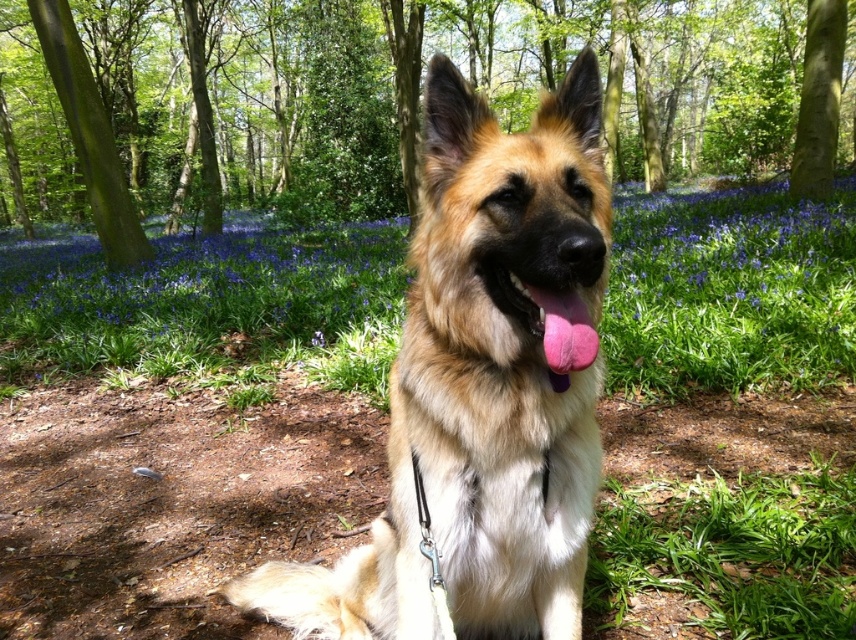
Does point (467, 529) come behind point (123, 211)?

No, it is not.

Between golden fur dog at center and green rough bark tree at upper left, which one appears on the right side from the viewer's perspective?

Positioned to the right is golden fur dog at center.

Where is `golden fur dog at center`? The height and width of the screenshot is (640, 856). golden fur dog at center is located at coordinates (483, 385).

Find the location of `golden fur dog at center`. golden fur dog at center is located at coordinates (483, 385).

Is green leafy tree at center bigger than green rough bark tree at upper left?

Correct, green leafy tree at center is larger in size than green rough bark tree at upper left.

Does point (236, 42) lie in front of point (60, 65)?

No, (236, 42) is further to viewer.

Is point (412, 150) more distant than point (143, 244)?

Yes, point (412, 150) is behind point (143, 244).

You are a GUI agent. You are given a task and a screenshot of the screen. Output one action in this format:
    pyautogui.click(x=<x>, y=<y>)
    Task: Click on the green leafy tree at center
    The height and width of the screenshot is (640, 856).
    Given the screenshot: What is the action you would take?
    pyautogui.click(x=381, y=97)

Is point (96, 180) positioned after point (801, 157)?

No, (96, 180) is in front of (801, 157).

Between point (92, 131) and point (811, 145), which one is positioned behind?

Point (92, 131)

Does point (51, 68) lie in front of point (800, 138)?

Yes, point (51, 68) is closer to viewer.

This screenshot has height=640, width=856. Identify the location of green rough bark tree at upper left. (90, 134).